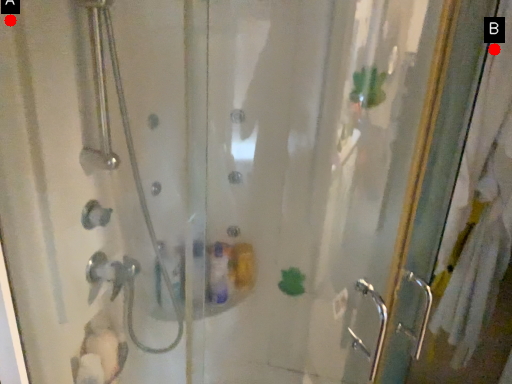
Question: Two points are circled on the image, labeled by A and B beside each circle. Which of the following is the farthest from the observer?

Choices:
 (A) A is further
 (B) B is further

Answer: (B)